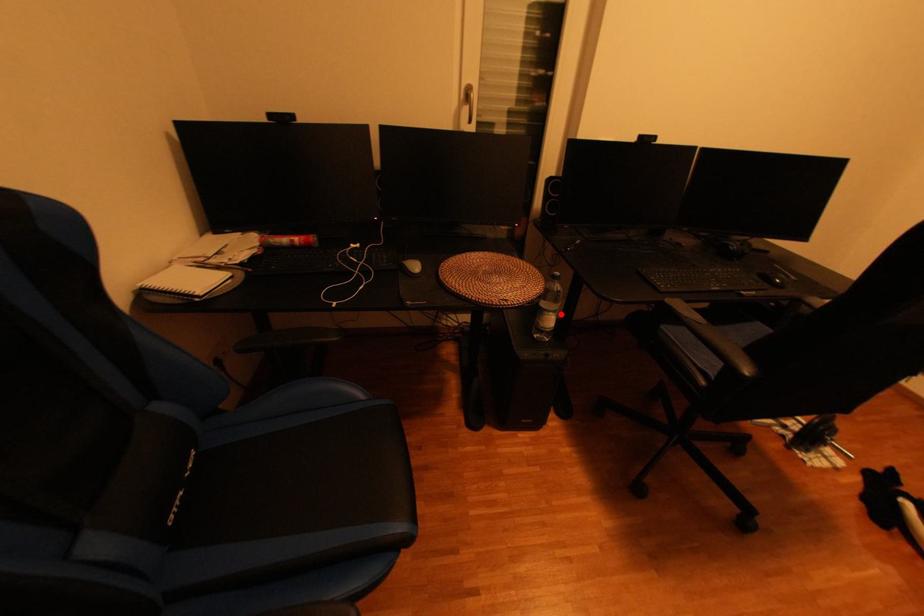
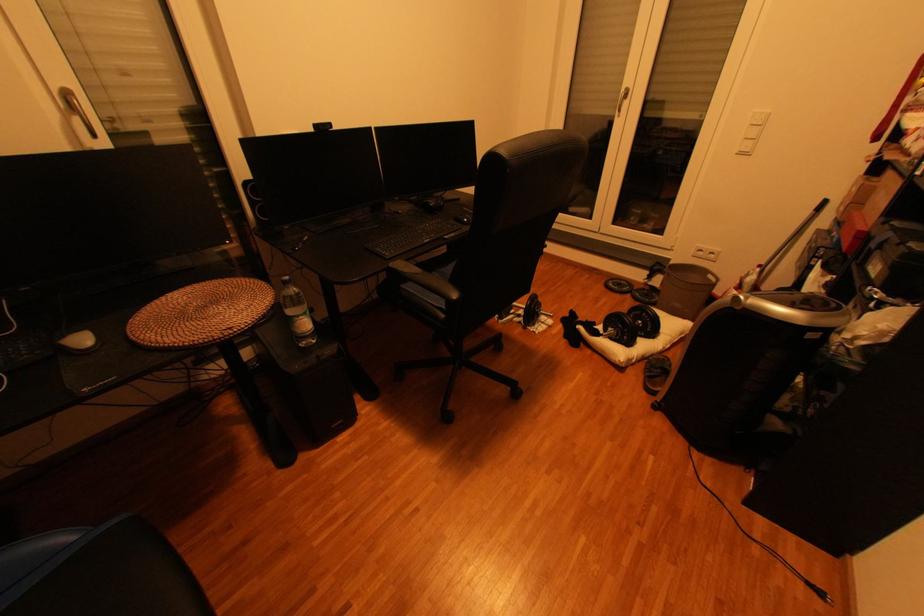
Question: I am providing you with two images of the same scene from different viewpoints. A red point is marked on the first image. Can you still see the location of the red point in image 2?

Choices:
 (A) Yes
 (B) No

Answer: (A)